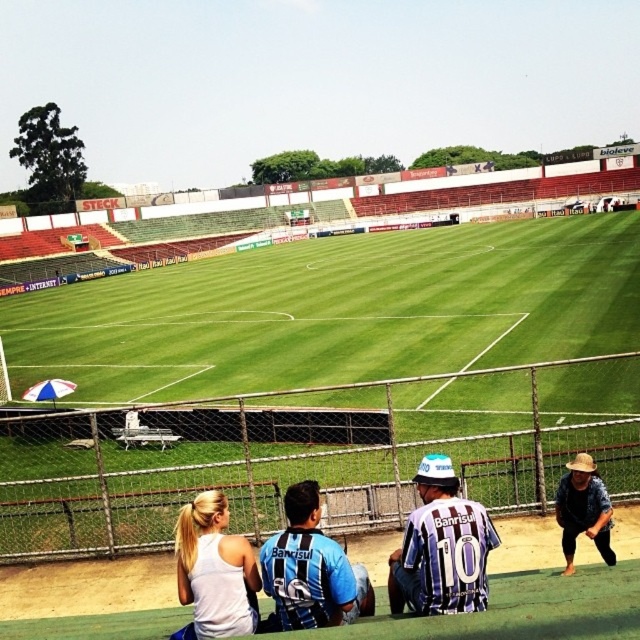
You are a photographer positioned at the edge of the soccer field. You want to take a photo of the purple striped jersey at center and the brown woven hat at lower right. Which object should you focus on first if you want to capture both in the same frame without moving the camera?

The purple striped jersey at center is above the brown woven hat at lower right, so you should focus on the purple striped jersey at center first as it is closer to the camera.

You are a photographer at the soccer stadium. You need to capture a photo of the white matte tank top at lower center. Where should you position your camera to ensure it is in the frame?

Position your camera to focus on the coordinates point at (212, 572) where the white matte tank top at lower center is located.

You are a photographer positioned at the center of the soccer field. You want to capture a photo that includes both the point at the edge of the field labeled as point 1 and another point further away. Which of the two points, point 1 at coordinates point (198, 634) or point (595, 500), should you focus on first to ensure both are in sharp focus?

Point (198, 634) is closer to the camera than point (595, 500). To ensure both are in focus, the photographer should focus on the closer point, point (198, 634), first.